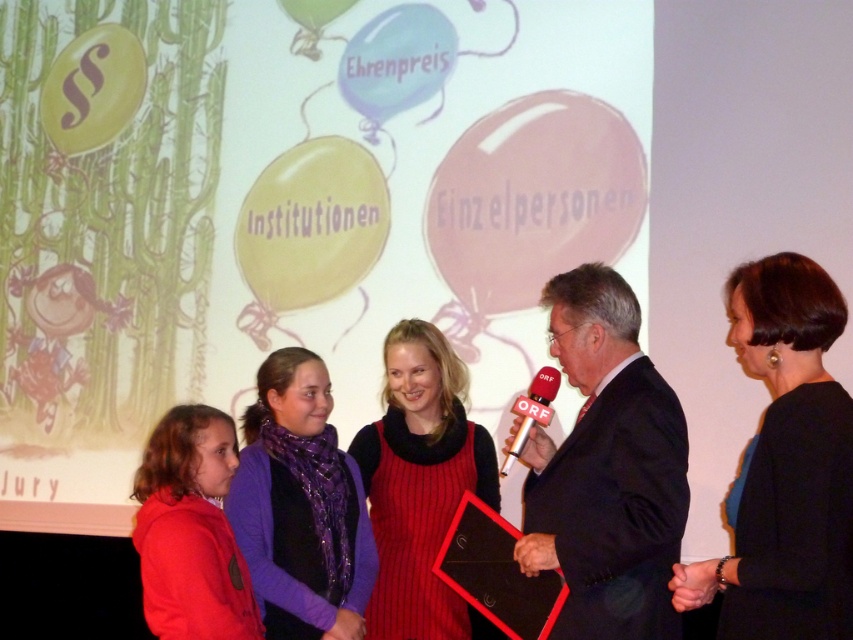
Which is more to the right, black satin dress at center or red plastic microphone at center?

Positioned to the right is black satin dress at center.

Which is in front, point (849, 476) or point (531, 413)?

Positioned in front is point (849, 476).

At what (x,y) coordinates should I click in order to perform the action: click on black satin dress at center. Please return your answer as a coordinate pair (x, y). Looking at the image, I should click on (786, 465).

Which of these two, black suit at center or black satin dress at center, stands taller?

black suit at center is taller.

Does black suit at center have a greater width compared to black satin dress at center?

Indeed, black suit at center has a greater width compared to black satin dress at center.

The width and height of the screenshot is (853, 640). What do you see at coordinates (606, 468) in the screenshot?
I see `black suit at center` at bounding box center [606, 468].

This screenshot has height=640, width=853. What are the coordinates of `black suit at center` in the screenshot? It's located at (606, 468).

Is black satin dress at center below matte red dress at center?

No, black satin dress at center is not below matte red dress at center.

Who is taller, black satin dress at center or matte red dress at center?

With more height is matte red dress at center.

Does point (729, 588) come behind point (480, 445)?

That is False.

This screenshot has width=853, height=640. I want to click on black satin dress at center, so click(x=786, y=465).